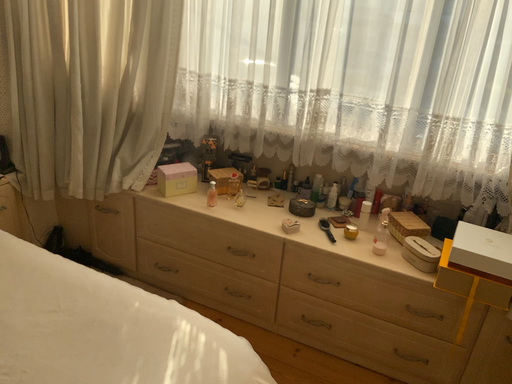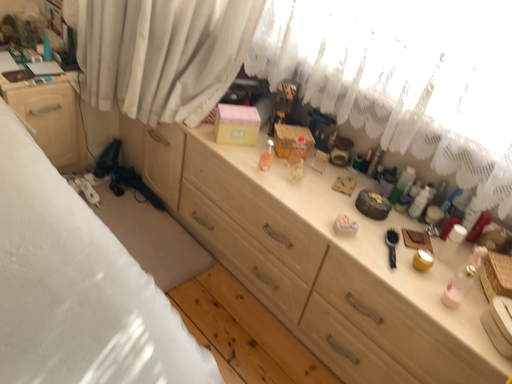
Question: How did the camera likely rotate when shooting the video?

Choices:
 (A) rotated upward
 (B) rotated downward

Answer: (B)